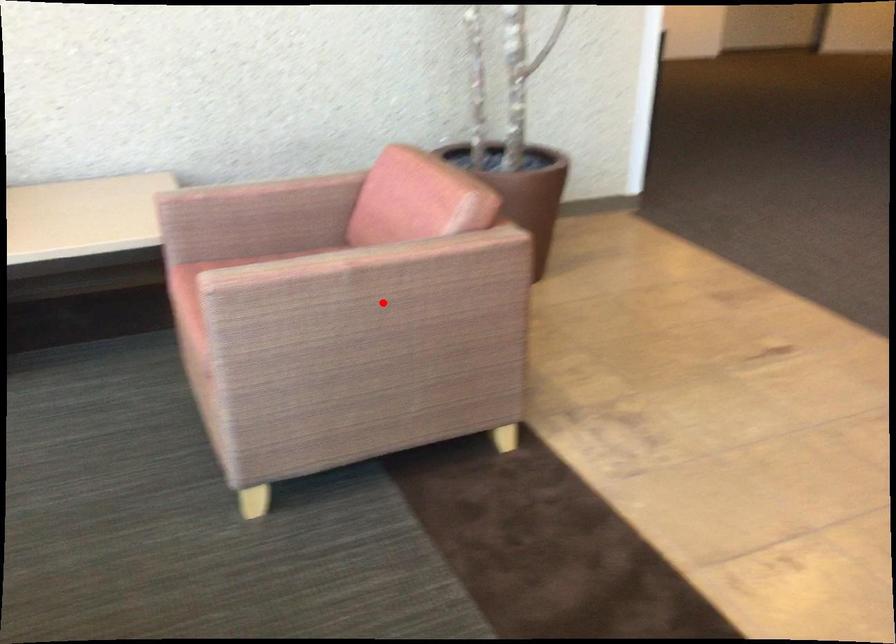
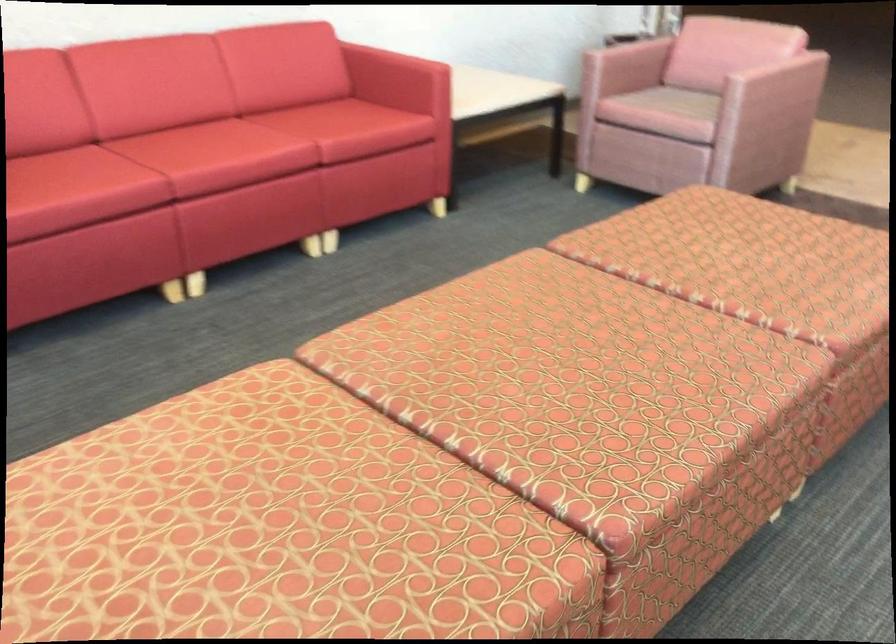
Question: I am providing you with two images of the same scene from different viewpoints. In image1, a red point is highlighted. Considering the same 3D point in image2, which of the following is correct?

Choices:
 (A) It is closer
 (B) It is farther

Answer: (B)